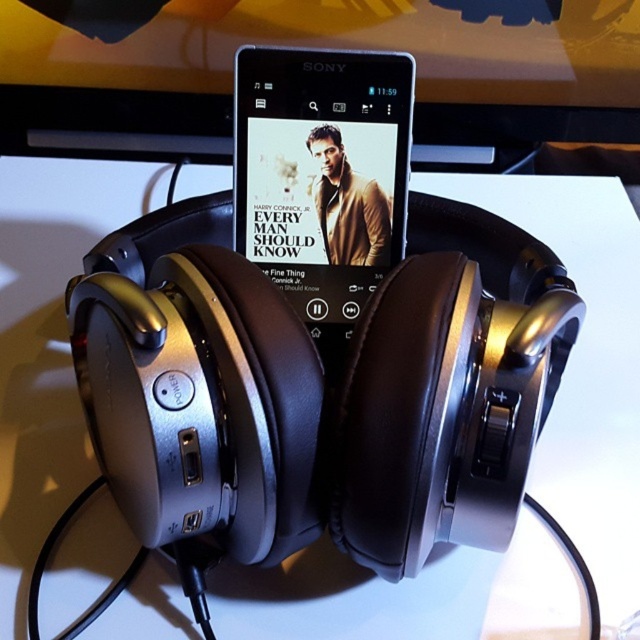
How distant is white matte table at center from satin black phone at center?

white matte table at center and satin black phone at center are 13.45 inches apart from each other.

Looking at this image, is white matte table at center wider than satin black phone at center?

Correct, the width of white matte table at center exceeds that of satin black phone at center.

Is point (595, 541) less distant than point (387, 61)?

Yes, it is.

This screenshot has width=640, height=640. In order to click on white matte table at center in this screenshot , I will do `click(588, 362)`.